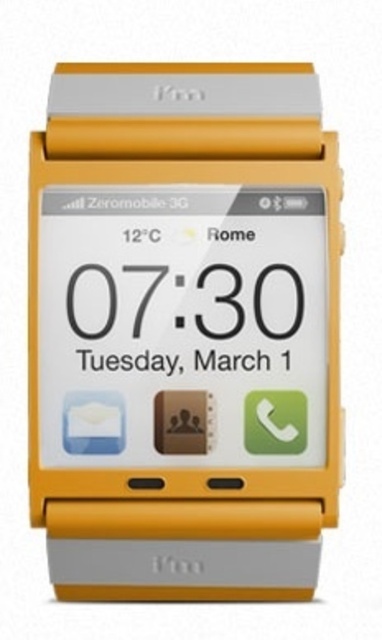
Can you confirm if yellow matte smartwatch at center is shorter than black glossy clock face at center?

No.

Based on the photo, can you confirm if yellow matte smartwatch at center is positioned above black glossy clock face at center?

No, yellow matte smartwatch at center is not above black glossy clock face at center.

Is point (271, 106) positioned behind point (207, 330)?

That is False.

You are a GUI agent. You are given a task and a screenshot of the screen. Output one action in this format:
    pyautogui.click(x=<x>, y=<y>)
    Task: Click on the yellow matte smartwatch at center
    
    Given the screenshot: What is the action you would take?
    pyautogui.click(x=184, y=330)